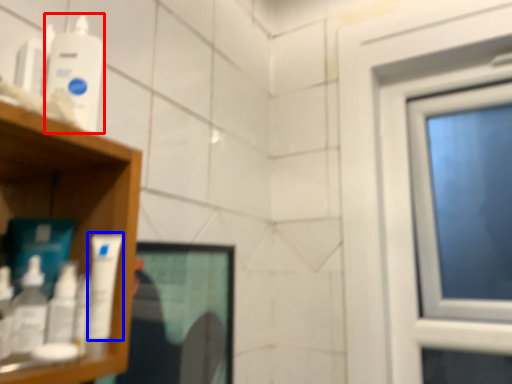
Question: Among these objects, which one is nearest to the camera, mouthwash (highlighted by a red box) or mouthwash (highlighted by a blue box)?

Choices:
 (A) mouthwash
 (B) mouthwash

Answer: (B)